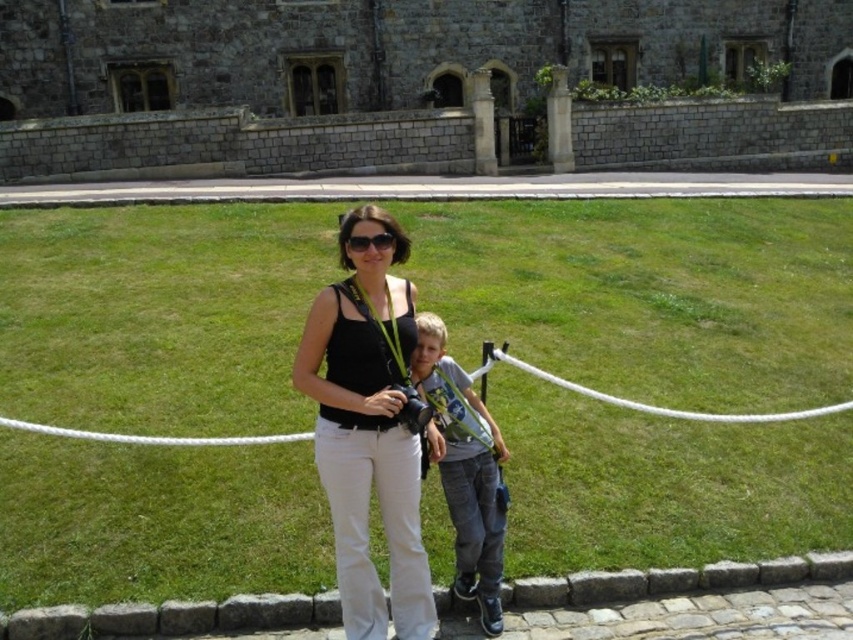
You are a photographer trying to capture a portrait of the two people in the scene. You notice the black matte tank top at center and the blue denim jeans at center. Which clothing item should you focus on to ensure it takes up more space in your photo?

The black matte tank top at center is bigger than the blue denim jeans at center, so focusing on it will ensure it takes up more space in the photo.

You are a photographer standing at the edge of the grassy field, and you want to take a photo of both the blue denim jeans at center and the black plastic sunglasses at center. If your camera can focus on objects within a 15 feet range, will both items be in focus?

The blue denim jeans at center is 15.25 feet away from the black plastic sunglasses at center. Since the camera can focus within 15 feet, the distance between them exceeds the camera range. Therefore, both items cannot be in focus simultaneously.

You are a delivery robot that needs to place a package between the black matte tank top at center and the blue denim jeans at center. The package requires a minimum of 3 meters of space to safely place it. Can you fit the package between them?

The black matte tank top at center and blue denim jeans at center are 2.74 meters apart from each other. Since the required space is 3 meters, the package cannot be safely placed between them.